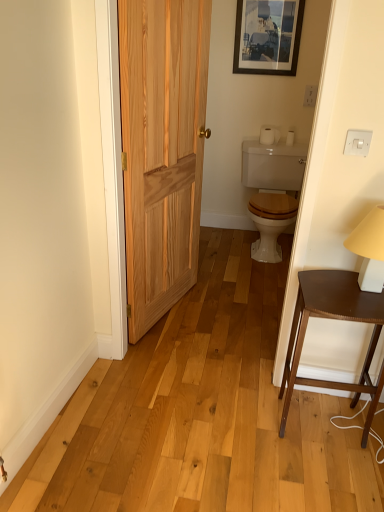
You are a GUI agent. You are given a task and a screenshot of the screen. Output one action in this format:
    pyautogui.click(x=<x>, y=<y>)
    Task: Click on the free space in front of dark brown wood table at right
    This screenshot has height=512, width=384.
    Given the screenshot: What is the action you would take?
    pyautogui.click(x=326, y=477)